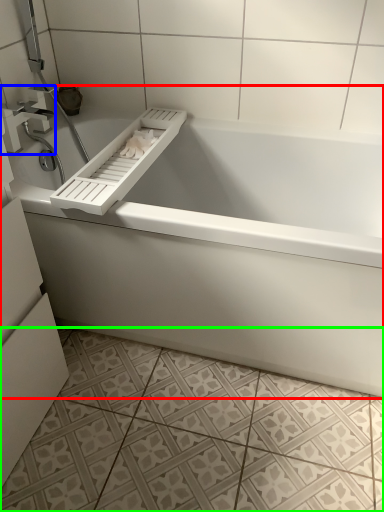
Question: Which object is the closest to the bathtub (highlighted by a red box)? Choose among these: tap (highlighted by a blue box) or ceramic tile (highlighted by a green box).

Choices:
 (A) tap
 (B) ceramic tile

Answer: (B)